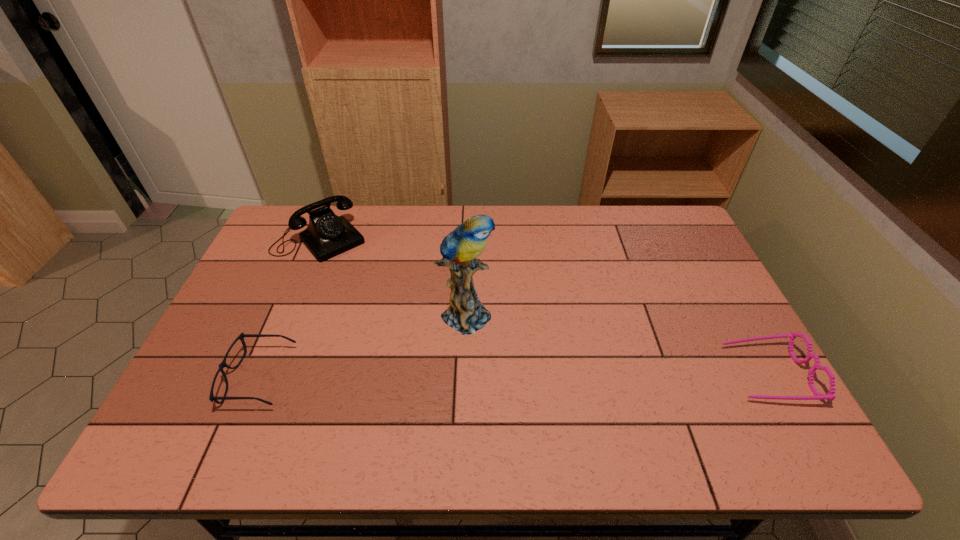
This screenshot has height=540, width=960. I want to click on vacant space at the near right corner of the desktop, so click(708, 387).

Where is `free spot between the shorter spectacles and the farthest object`? free spot between the shorter spectacles and the farthest object is located at coordinates (289, 309).

The image size is (960, 540). I want to click on free space between the third object from left to right and the right spectacles, so click(x=616, y=343).

This screenshot has height=540, width=960. What are the coordinates of `unoccupied position between the shortest object and the third object from left to right` in the screenshot? It's located at (362, 345).

The height and width of the screenshot is (540, 960). I want to click on free space between the third shortest object and the left spectacles, so click(x=289, y=309).

Find the location of a particular element. free space between the right spectacles and the shortest object is located at coordinates (513, 376).

The image size is (960, 540). What are the coordinates of `vacant area that lies between the third tallest object and the third shortest object` in the screenshot? It's located at (543, 307).

Identify the location of unoccupied area between the tallest object and the left spectacles. pos(362,345).

The width and height of the screenshot is (960, 540). Find the location of `empty space between the tallest object and the right spectacles`. empty space between the tallest object and the right spectacles is located at coordinates (616, 343).

I want to click on unoccupied position between the telephone and the tallest object, so click(394, 276).